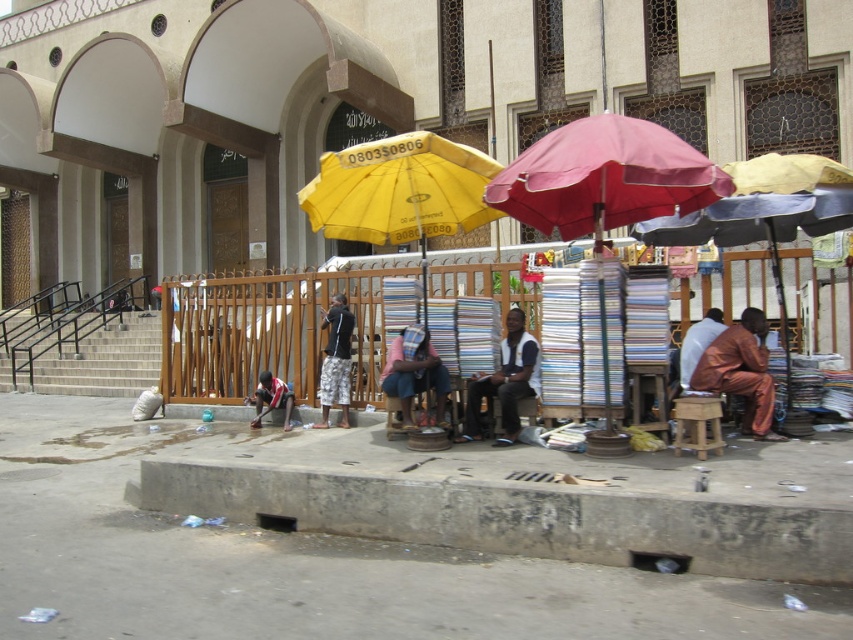
Who is lower down, matte brown suit at center right or pink fabric at center?

pink fabric at center is lower down.

Is matte brown suit at center right positioned behind pink fabric at center?

No, matte brown suit at center right is closer to the viewer.

Where is `matte brown suit at center right`? The image size is (853, 640). matte brown suit at center right is located at coordinates (741, 371).

I want to click on matte brown suit at center right, so click(741, 371).

Is gray concrete curb at lower center wider than dark gray fabric pants at center?

Yes.

Which is more to the right, gray concrete curb at lower center or dark gray fabric pants at center?

From the viewer's perspective, gray concrete curb at lower center appears more on the right side.

Which is in front, point (320, 476) or point (335, 381)?

Point (320, 476) is in front.

I want to click on gray concrete curb at lower center, so click(515, 515).

Between point (364, 500) and point (322, 170), which one is positioned in front?

Point (364, 500) is in front.

Identify the location of gray concrete curb at lower center. The height and width of the screenshot is (640, 853). (515, 515).